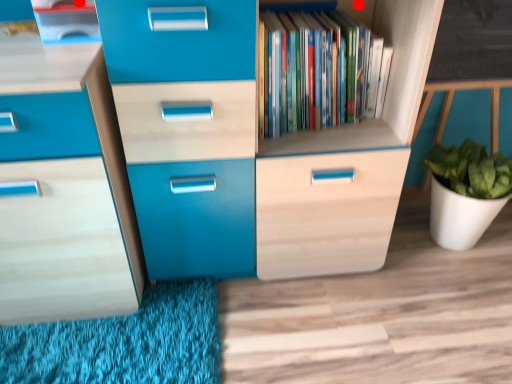
Question: Two points are circled on the image, labeled by A and B beside each circle. Which point is closer to the camera taking this photo?

Choices:
 (A) A is closer
 (B) B is closer

Answer: (A)